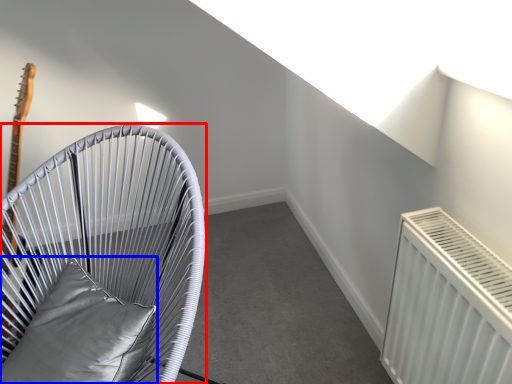
Question: Which point is closer to the camera, furniture (highlighted by a red box) or pillow (highlighted by a blue box)?

Choices:
 (A) furniture
 (B) pillow

Answer: (A)